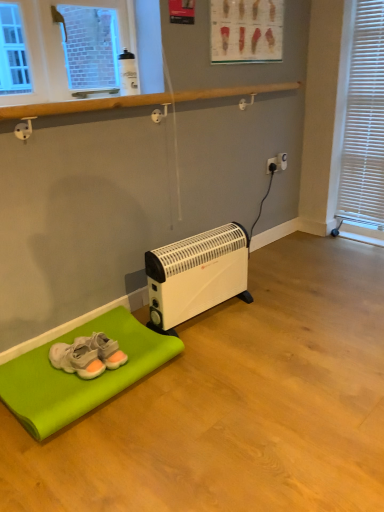
Find the location of `vacant space to the right of gray suede sneakers at lower left`. vacant space to the right of gray suede sneakers at lower left is located at coordinates (135, 355).